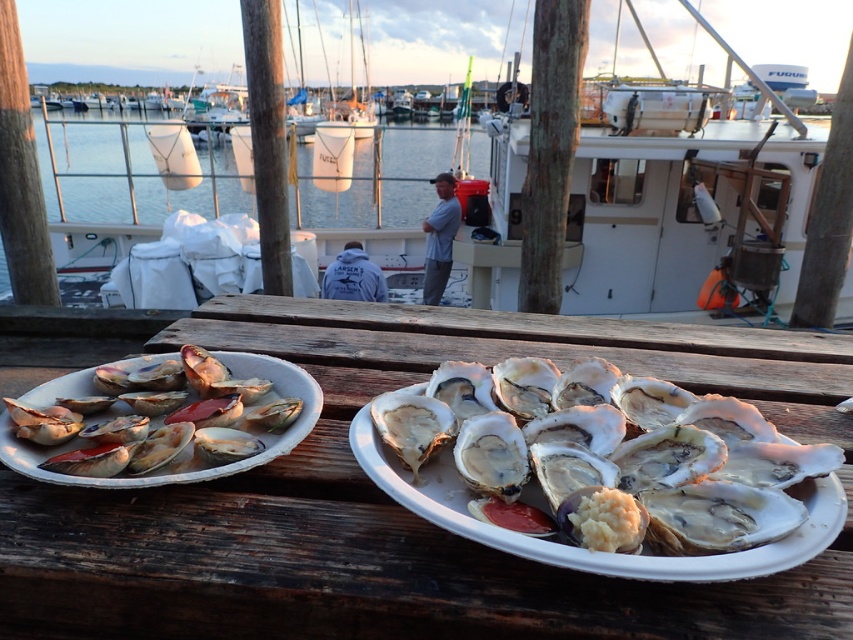
Question: Can you confirm if white matte boat at center is positioned above shiny red shell at left?

Choices:
 (A) yes
 (B) no

Answer: (A)

Question: Does wooden table at center have a greater width compared to shiny red shell at left?

Choices:
 (A) yes
 (B) no

Answer: (A)

Question: Can you confirm if shiny white oyster at center is positioned below white matte boat at center?

Choices:
 (A) no
 (B) yes

Answer: (B)

Question: Which object is farther from the camera taking this photo?

Choices:
 (A) shiny red shell at left
 (B) shiny white oyster at center
 (C) wooden table at center
 (D) white matte boat at center

Answer: (D)

Question: Which of the following is the farthest from the observer?

Choices:
 (A) shiny red shell at left
 (B) white matte boat at center

Answer: (B)

Question: Which point is farther to the camera?

Choices:
 (A) wooden table at center
 (B) white matte boat at center
 (C) shiny red shell at left
 (D) shiny white oyster at center

Answer: (B)